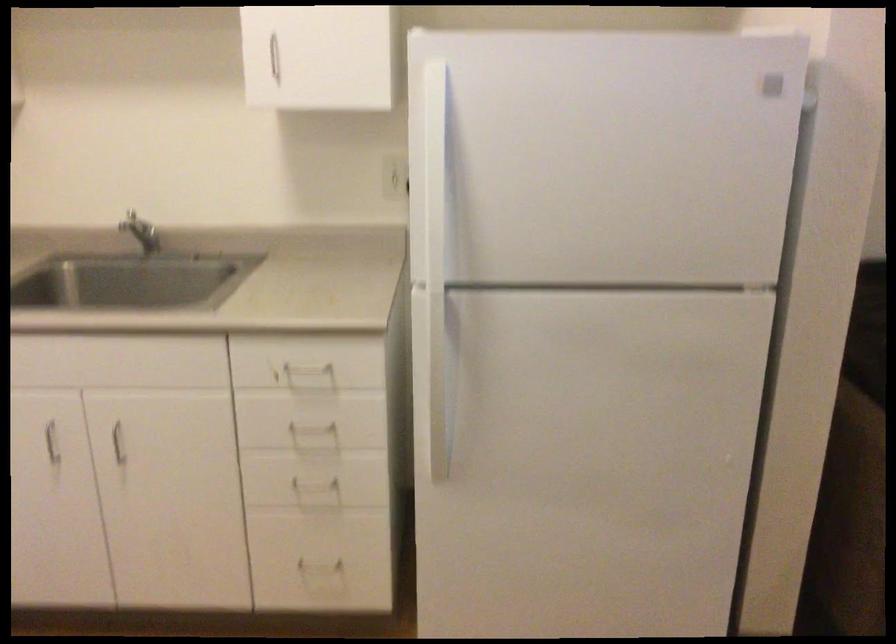
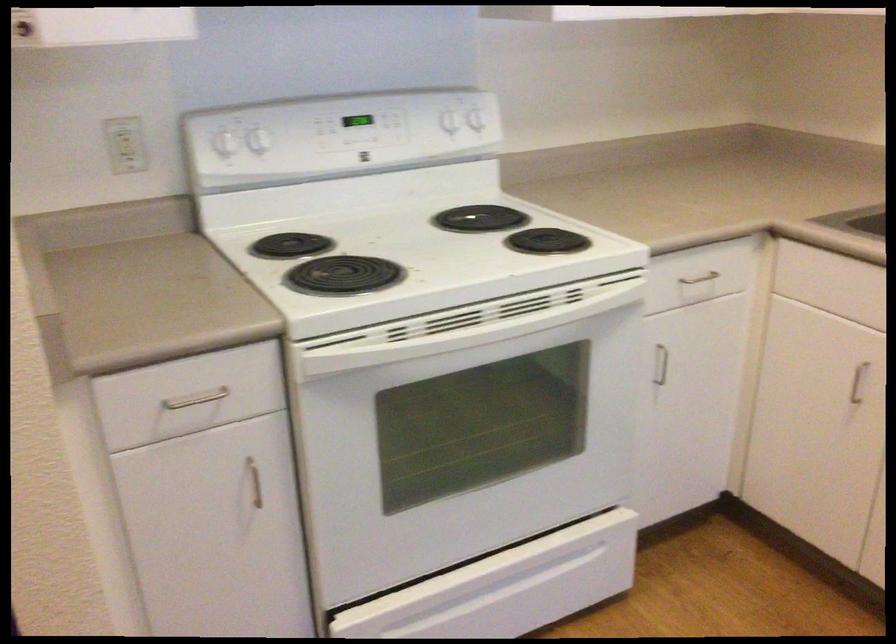
Question: The first image is from the beginning of the video and the second image is from the end. How did the camera likely rotate when shooting the video?

Choices:
 (A) Left
 (B) Right
 (C) Up
 (D) Down

Answer: (A)